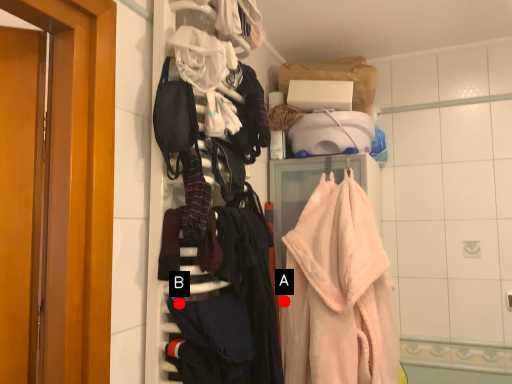
Question: Two points are circled on the image, labeled by A and B beside each circle. Which of the following is the closest to the observer?

Choices:
 (A) A is closer
 (B) B is closer

Answer: (B)